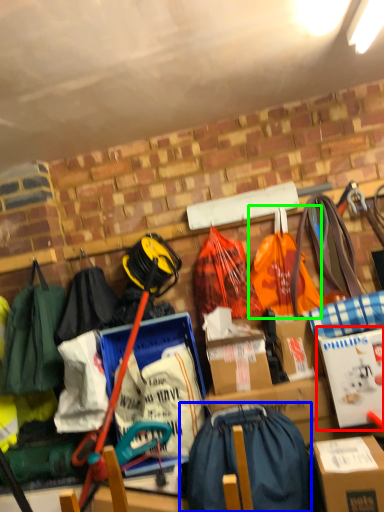
Question: Based on their relative distances, which object is nearer to cardboard box (highlighted by a red box)? Choose from shoulder bag (highlighted by a blue box) and grocery bag (highlighted by a green box).

Choices:
 (A) shoulder bag
 (B) grocery bag

Answer: (A)